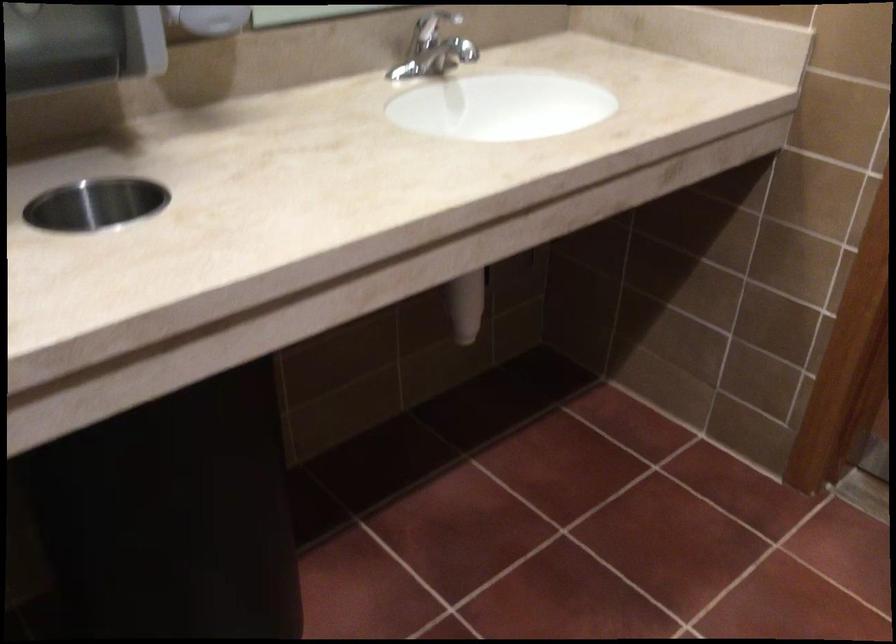
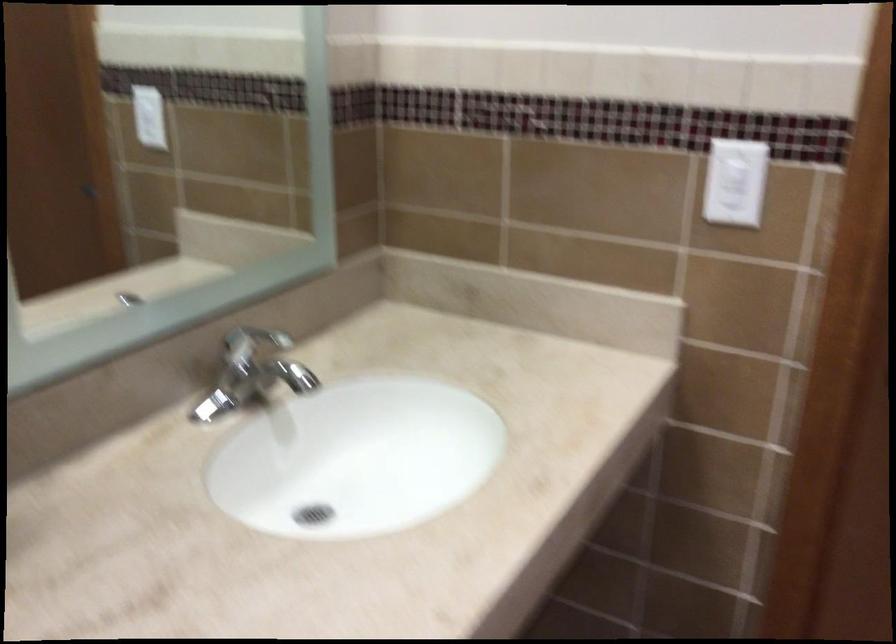
What movement of the cameraman would produce the second image?

The cameraman walked toward left, forward.